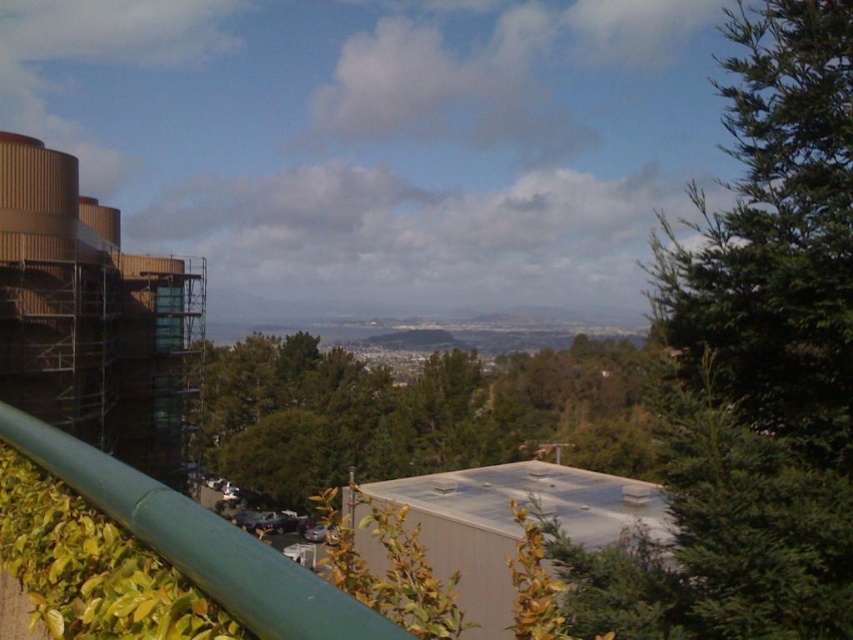
Between green textured tree at upper right and green leafy tree at center, which one appears on the left side from the viewer's perspective?

green textured tree at upper right is more to the left.

Based on the photo, can you confirm if green textured tree at upper right is wider than green leafy tree at center?

Incorrect, green textured tree at upper right's width does not surpass green leafy tree at center's.

The width and height of the screenshot is (853, 640). Describe the element at coordinates (753, 368) in the screenshot. I see `green textured tree at upper right` at that location.

Image resolution: width=853 pixels, height=640 pixels. Identify the location of green textured tree at upper right. (753, 368).